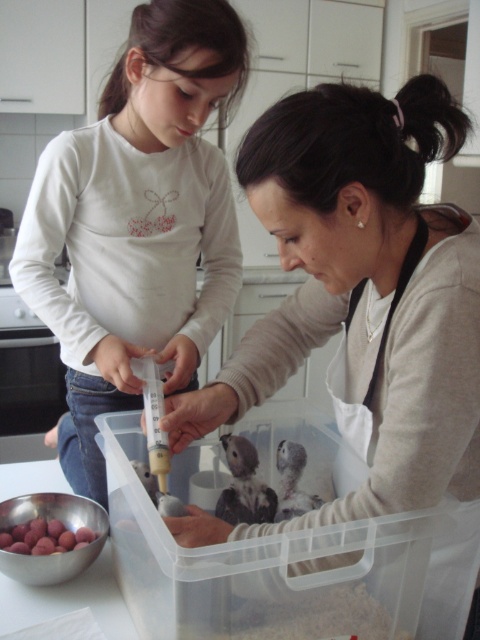
Question: Does matte white shirt at upper left appear on the right side of smooth metallic bowl at lower left?

Choices:
 (A) yes
 (B) no

Answer: (A)

Question: Based on their relative distances, which object is farther from the matte white shirt at upper left?

Choices:
 (A) matte white apron at center
 (B) smooth metallic bowl at lower left

Answer: (B)

Question: Which object appears farthest from the camera in this image?

Choices:
 (A) fluffy gray bird at center
 (B) matte white apron at center
 (C) matte white shirt at upper left
 (D) smooth metallic bowl at lower left

Answer: (D)

Question: Does matte white shirt at upper left appear on the right side of smooth metallic bowl at lower left?

Choices:
 (A) no
 (B) yes

Answer: (B)

Question: Based on their relative distances, which object is nearer to the smooth metallic bowl at lower left?

Choices:
 (A) matte white apron at center
 (B) matte white shirt at upper left

Answer: (B)

Question: Is matte white shirt at upper left to the left of smooth metallic bowl at lower left from the viewer's perspective?

Choices:
 (A) no
 (B) yes

Answer: (A)